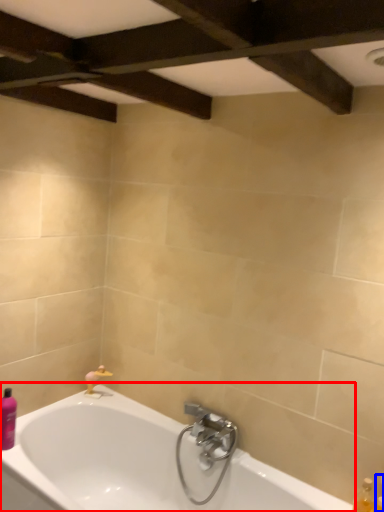
Question: Among these objects, which one is nearest to the camera, bathtub (highlighted by a red box) or toiletry (highlighted by a blue box)?

Choices:
 (A) bathtub
 (B) toiletry

Answer: (A)